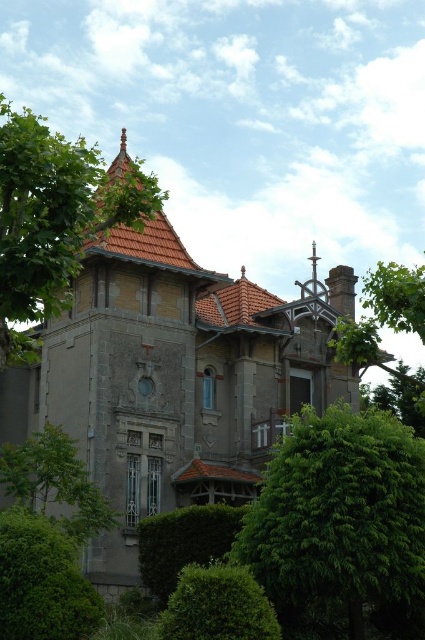
Can you confirm if green leafy tree at right is thinner than green leafy tree at lower left?

No, green leafy tree at right is not thinner than green leafy tree at lower left.

Does green leafy tree at right appear on the left side of green leafy tree at lower left?

No, green leafy tree at right is not to the left of green leafy tree at lower left.

Between point (424, 269) and point (8, 449), which one is positioned in front?

Point (424, 269) is more forward.

This screenshot has height=640, width=425. In order to click on green leafy tree at right in this screenshot , I will do `click(379, 337)`.

Who is lower down, green leafy tree at center or green leafy tree at left?

Positioned lower is green leafy tree at center.

Does point (317, 573) come closer to viewer compared to point (136, 196)?

Yes, it is.

This screenshot has width=425, height=640. What are the coordinates of `green leafy tree at center` in the screenshot? It's located at (340, 516).

Describe the element at coordinates (54, 218) in the screenshot. I see `green leafy tree at left` at that location.

Does point (39, 164) come farther from viewer compared to point (23, 531)?

That is False.

This screenshot has height=640, width=425. In order to click on green leafy tree at left in this screenshot , I will do `click(54, 218)`.